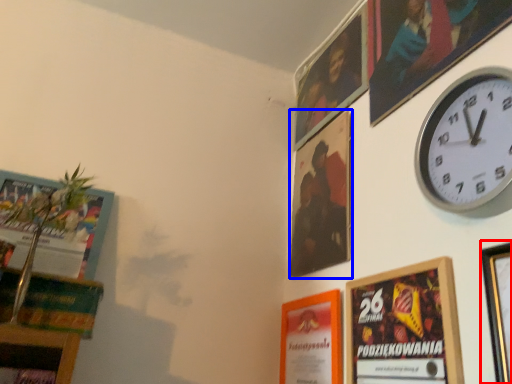
Question: Which object is closer to the camera taking this photo, picture frame (highlighted by a red box) or picture frame (highlighted by a blue box)?

Choices:
 (A) picture frame
 (B) picture frame

Answer: (A)